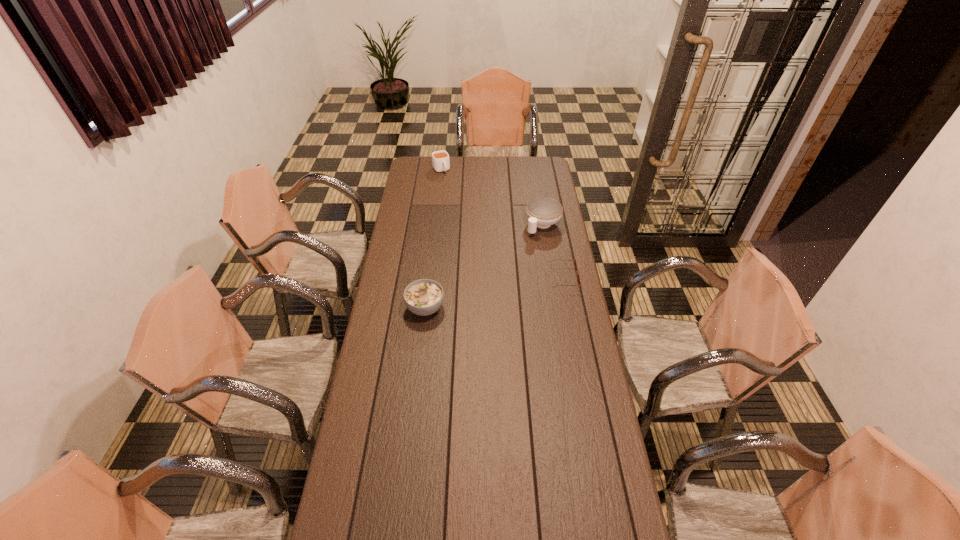
You are a GUI agent. You are given a task and a screenshot of the screen. Output one action in this format:
    pyautogui.click(x=<x>, y=<y>)
    Task: Click on the free space located on the side with the handle of the farthest object
    The width and height of the screenshot is (960, 540).
    Given the screenshot: What is the action you would take?
    pyautogui.click(x=457, y=197)

Locate an element on the screen. vacant area situated on the side with the handle of the farthest object is located at coordinates (462, 204).

Where is `object located at the far edge`? This screenshot has height=540, width=960. object located at the far edge is located at coordinates (440, 159).

Where is `soup bowl that is at the left edge`? Image resolution: width=960 pixels, height=540 pixels. soup bowl that is at the left edge is located at coordinates (423, 297).

Locate an element on the screen. cup located in the left edge section of the desktop is located at coordinates (440, 159).

The image size is (960, 540). I want to click on sunglasses located at the right edge, so click(575, 262).

Identify the location of chinaware that is positioned at the right edge. (542, 212).

Locate an element on the screen. Image resolution: width=960 pixels, height=540 pixels. object situated at the far left corner is located at coordinates (440, 159).

Image resolution: width=960 pixels, height=540 pixels. In order to click on free region at the far edge of the desktop in this screenshot , I will do `click(466, 174)`.

This screenshot has width=960, height=540. I want to click on free space at the near edge of the desktop, so coord(552,503).